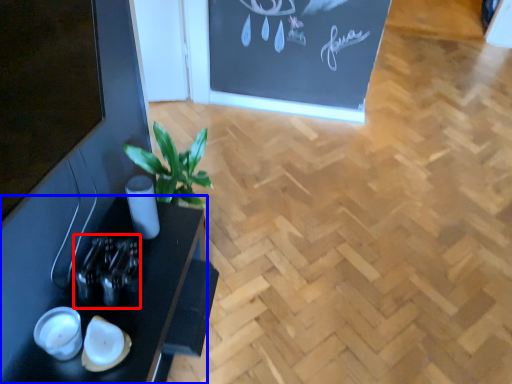
Question: Which object is further to the camera taking this photo, bottle (highlighted by a red box) or table (highlighted by a blue box)?

Choices:
 (A) bottle
 (B) table

Answer: (A)